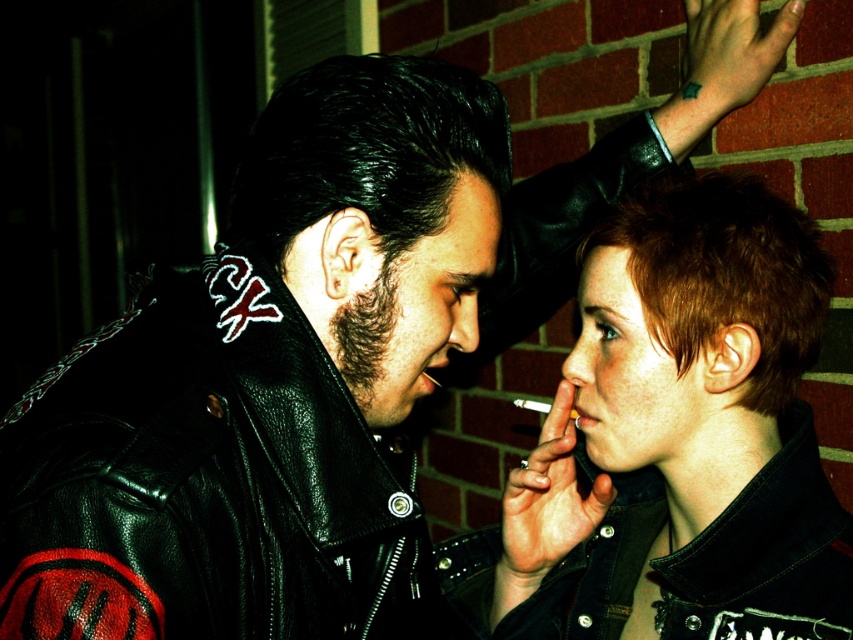
Between denim jacket at center and black leather jacket at upper left, which one has less height?

With less height is black leather jacket at upper left.

Is point (738, 525) positioned in front of point (22, 458)?

No, (738, 525) is further to viewer.

Which is in front, point (727, 337) or point (401, 451)?

Positioned in front is point (727, 337).

Locate an element on the screen. denim jacket at center is located at coordinates (676, 440).